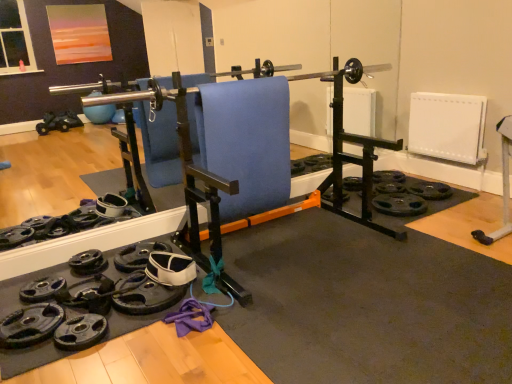
Question: Considering the positions of point (90, 271) and point (348, 177), is point (90, 271) closer or farther from the camera than point (348, 177)?

Choices:
 (A) farther
 (B) closer

Answer: (B)

Question: From a real-world perspective, is black rubber weight plate at lower left, the second wheel viewed from the left, physically located above or below black rubber weight plate at center, acting as the first wheel starting from the right?

Choices:
 (A) below
 (B) above

Answer: (A)

Question: Which of these objects is positioned farthest from the black rubber weight plate at lower left, the second wheel when ordered from top to bottom?

Choices:
 (A) blue fabric swivel chair at center
 (B) black rubber weight plate at center, the first wheel positioned from the top
 (C) black rubber weight plate at lower left, which is the first wheel in left-to-right order

Answer: (B)

Question: Based on their relative distances, which object is farther from the black rubber weight plate at lower left, the third wheel positioned from the right?

Choices:
 (A) black rubber weight plate at lower left, the second wheel when ordered from top to bottom
 (B) blue fabric swivel chair at center
 (C) black rubber weight plate at center, the 1th wheel viewed from the back

Answer: (C)